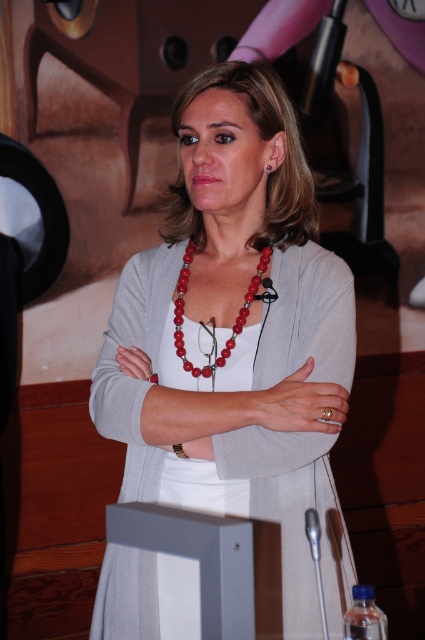
You are a fashion designer analyzing the outfit of the woman in the image. Which item has a greater height between the matte gray cardigan at center and the red beaded necklace at center?

The matte gray cardigan at center has a greater height compared to the red beaded necklace at center.

The woman is wearing a red beaded necklace at center and a red glass earring at center. Which one is positioned lower on her body?

The red beaded necklace at center is located below the red glass earring at center, so the red beaded necklace at center is positioned lower on her body.